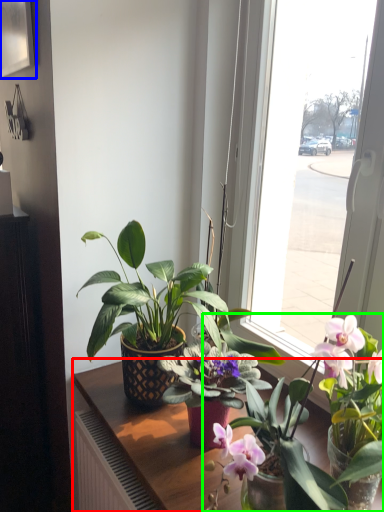
Question: Based on their relative distances, which object is nearer to table (highlighted by a red box)? Choose from picture frame (highlighted by a blue box) and houseplant (highlighted by a green box).

Choices:
 (A) picture frame
 (B) houseplant

Answer: (B)